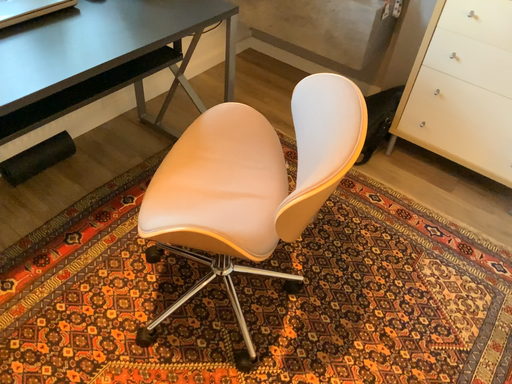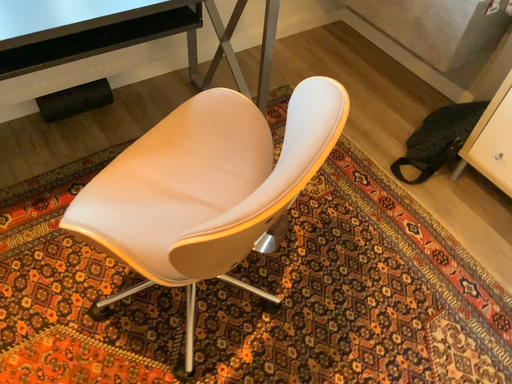
Question: Which way did the camera rotate in the video?

Choices:
 (A) rotated right
 (B) rotated left

Answer: (B)